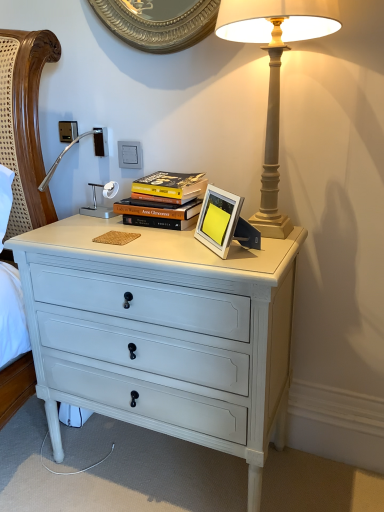
The width and height of the screenshot is (384, 512). I want to click on white plastic electric outlet at upper center, so click(130, 154).

The width and height of the screenshot is (384, 512). What do you see at coordinates (163, 201) in the screenshot?
I see `hardcover books at center` at bounding box center [163, 201].

Image resolution: width=384 pixels, height=512 pixels. Describe the element at coordinates (218, 220) in the screenshot. I see `silver metallic picture frame at center` at that location.

Measure the distance between point (x=218, y=198) and camera.

They are 3.37 feet apart.

Describe the element at coordinates (274, 75) in the screenshot. The height and width of the screenshot is (512, 384). I see `matte beige lamp at upper right` at that location.

The image size is (384, 512). I want to click on white painted wood chest of drawers at center, so click(x=163, y=333).

Is silver metallic picture frame at center at the left side of matte beige lamp at upper right?

Yes.

Does silver metallic picture frame at center have a greater height compared to matte beige lamp at upper right?

No.

From the image's perspective, does silver metallic picture frame at center appear lower than matte beige lamp at upper right?

Yes, from the image's perspective, silver metallic picture frame at center is beneath matte beige lamp at upper right.

Based on the photo, is hardcover books at center wider or thinner than silver metallic picture frame at center?

In the image, hardcover books at center appears to be wider than silver metallic picture frame at center.

How different are the orientations of hardcover books at center and silver metallic picture frame at center in degrees?

There is a 46.8-degree angle between the facing directions of hardcover books at center and silver metallic picture frame at center.

Between point (151, 205) and point (227, 248), which one is positioned in front?

The point (227, 248) is closer to the camera.

Is hardcover books at center in front of or behind silver metallic picture frame at center in the image?

Visually, hardcover books at center is located behind silver metallic picture frame at center.

Are silver metallic picture frame at center and hardcover books at center far apart?

No, silver metallic picture frame at center is in close proximity to hardcover books at center.

How many degrees apart are the facing directions of silver metallic picture frame at center and hardcover books at center?

silver metallic picture frame at center and hardcover books at center are facing 46.8 degrees away from each other.

Which object is positioned more to the right, silver metallic picture frame at center or hardcover books at center?

Positioned to the right is silver metallic picture frame at center.

Is silver metallic picture frame at center closer to the viewer compared to hardcover books at center?

Yes, it is.

Can you confirm if white plastic electric outlet at upper center is taller than silver metallic picture frame at center?

No, white plastic electric outlet at upper center is not taller than silver metallic picture frame at center.

Considering the positions of objects white plastic electric outlet at upper center and silver metallic picture frame at center in the image provided, who is more to the left, white plastic electric outlet at upper center or silver metallic picture frame at center?

Positioned to the left is white plastic electric outlet at upper center.

The image size is (384, 512). What are the coordinates of `picture frame below the white plastic electric outlet at upper center (from the image's perspective)` in the screenshot? It's located at (218, 220).

Is silver metallic picture frame at center at the back of white plastic electric outlet at upper center?

white plastic electric outlet at upper center does not have its back to silver metallic picture frame at center.

Is point (132, 162) in front of point (197, 200)?

No.

Between white plastic electric outlet at upper center and hardcover books at center, which one is positioned in front?

hardcover books at center is in front.

Based on the photo, is hardcover books at center surrounded by white plastic electric outlet at upper center?

No, hardcover books at center is located outside of white plastic electric outlet at upper center.

Find the location of a particular element. The height and width of the screenshot is (512, 384). book on the left of the matte beige lamp at upper right is located at coordinates (163, 201).

Is hardcover books at center directly adjacent to matte beige lamp at upper right?

hardcover books at center and matte beige lamp at upper right are clearly separated.

Is point (163, 197) closer to viewer compared to point (245, 18)?

That is False.

What's the angular difference between hardcover books at center and matte beige lamp at upper right's facing directions?

There is a 0.000214-degree angle between the facing directions of hardcover books at center and matte beige lamp at upper right.

Considering the relative sizes of white painted wood chest of drawers at center and white plastic electric outlet at upper center in the image provided, is white painted wood chest of drawers at center smaller than white plastic electric outlet at upper center?

Actually, white painted wood chest of drawers at center might be larger than white plastic electric outlet at upper center.

Which is nearer, (128, 373) or (119, 150)?

Point (128, 373).

The height and width of the screenshot is (512, 384). What are the coordinates of `electric outlet above the white painted wood chest of drawers at center (from the image's perspective)` in the screenshot? It's located at click(130, 154).

Is white painted wood chest of drawers at center beside white plastic electric outlet at upper center?

There is a gap between white painted wood chest of drawers at center and white plastic electric outlet at upper center.

Find the location of a particular element. picture frame that appears behind the matte beige lamp at upper right is located at coordinates (218, 220).

This screenshot has width=384, height=512. Identify the location of picture frame on the right of hardcover books at center. (218, 220).

Looking at the image, which one is located closer to white plastic electric outlet at upper center, matte beige lamp at upper right or white painted wood chest of drawers at center?

matte beige lamp at upper right is positioned closer to the anchor white plastic electric outlet at upper center.

When comparing their distances from white painted wood chest of drawers at center, does white plastic electric outlet at upper center or matte beige lamp at upper right seem further?

Based on the image, white plastic electric outlet at upper center appears to be further to white painted wood chest of drawers at center.

Consider the image. When comparing their distances from hardcover books at center, does matte beige lamp at upper right or white plastic electric outlet at upper center seem closer?

white plastic electric outlet at upper center lies closer to hardcover books at center than the other object.

Looking at the image, which one is located closer to white painted wood chest of drawers at center, white plastic electric outlet at upper center or hardcover books at center?

Based on the image, hardcover books at center appears to be nearer to white painted wood chest of drawers at center.

Considering their positions, is white plastic electric outlet at upper center positioned closer to silver metallic picture frame at center than hardcover books at center?

The object closer to silver metallic picture frame at center is hardcover books at center.

From the image, which object appears to be nearer to white painted wood chest of drawers at center, hardcover books at center or white plastic electric outlet at upper center?

hardcover books at center lies closer to white painted wood chest of drawers at center than the other object.

Considering their positions, is matte beige lamp at upper right positioned closer to white painted wood chest of drawers at center than silver metallic picture frame at center?

silver metallic picture frame at center is closer to white painted wood chest of drawers at center.

Which object lies nearer to the anchor point white painted wood chest of drawers at center, silver metallic picture frame at center or hardcover books at center?

silver metallic picture frame at center is positioned closer to the anchor white painted wood chest of drawers at center.

The width and height of the screenshot is (384, 512). I want to click on book between matte beige lamp at upper right and white plastic electric outlet at upper center along the z-axis, so click(x=163, y=201).

I want to click on picture frame between white plastic electric outlet at upper center and white painted wood chest of drawers at center vertically, so pyautogui.click(x=218, y=220).

This screenshot has height=512, width=384. Find the location of `picture frame that lies between hardcover books at center and white painted wood chest of drawers at center from top to bottom`. picture frame that lies between hardcover books at center and white painted wood chest of drawers at center from top to bottom is located at coordinates (218, 220).

You are a GUI agent. You are given a task and a screenshot of the screen. Output one action in this format:
    pyautogui.click(x=<x>, y=<y>)
    Task: Click on the picture frame between matte beige lamp at upper right and white painted wood chest of drawers at center in the vertical direction
    
    Given the screenshot: What is the action you would take?
    pyautogui.click(x=218, y=220)